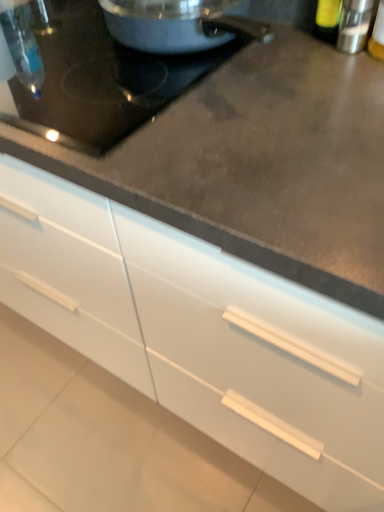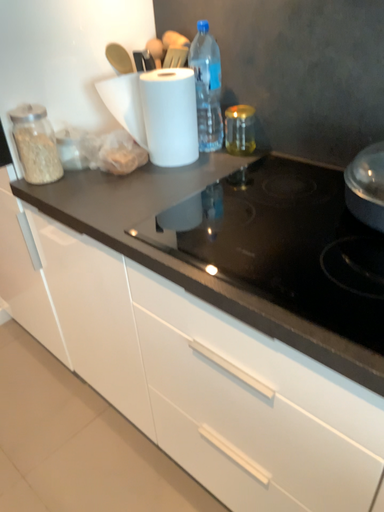
Question: Which way did the camera rotate in the video?

Choices:
 (A) rotated downward
 (B) rotated upward

Answer: (B)